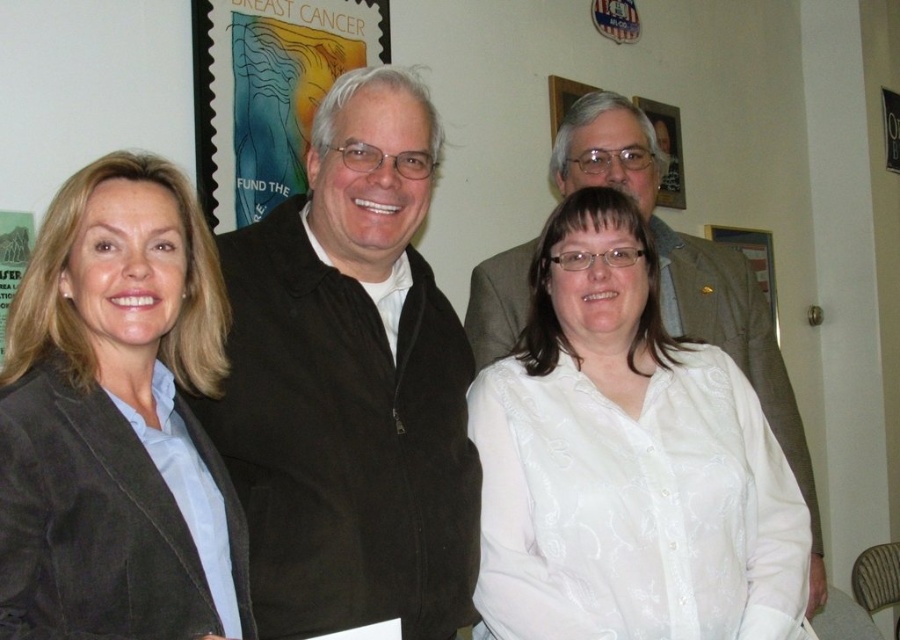
Is point (306, 516) farther from viewer compared to point (131, 486)?

Yes, it is.

Between black corduroy jacket at center and suede jacket at left, which one has less height?

Standing shorter between the two is suede jacket at left.

The width and height of the screenshot is (900, 640). I want to click on black corduroy jacket at center, so click(x=351, y=384).

Which of these two, suede jacket at left or breast cancer awareness poster at upper left, stands taller?

breast cancer awareness poster at upper left

Does suede jacket at left have a lesser width compared to breast cancer awareness poster at upper left?

Correct, suede jacket at left's width is less than breast cancer awareness poster at upper left's.

Where is `suede jacket at left`? The width and height of the screenshot is (900, 640). suede jacket at left is located at coordinates (110, 413).

Between black corduroy jacket at center and breast cancer awareness poster at upper left, which one has more height?

With more height is black corduroy jacket at center.

Between point (324, 106) and point (208, 113), which one is positioned in front?

Point (324, 106) is in front.

Find the location of a particular element. black corduroy jacket at center is located at coordinates (351, 384).